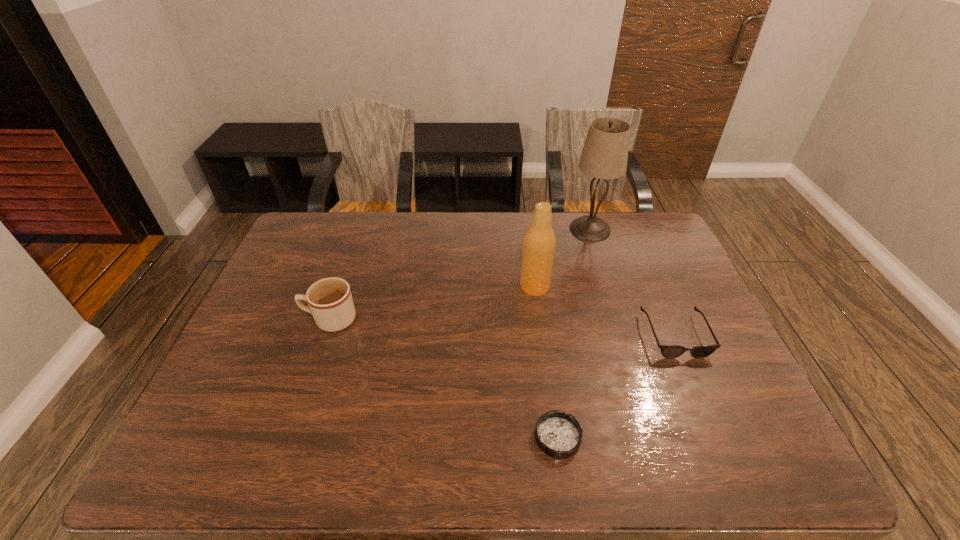
Find the location of `the farthest object`. the farthest object is located at coordinates (604, 156).

Locate an element on the screen. lampshade is located at coordinates (604, 156).

Where is `the second tallest object`? Image resolution: width=960 pixels, height=540 pixels. the second tallest object is located at coordinates (x=539, y=243).

Identify the location of the fourth nearest object. Image resolution: width=960 pixels, height=540 pixels. (539, 243).

The image size is (960, 540). Identify the location of mug. (330, 302).

Identify the location of the leftmost object. Image resolution: width=960 pixels, height=540 pixels. (330, 302).

Where is `sunglasses`? The width and height of the screenshot is (960, 540). sunglasses is located at coordinates (668, 351).

Where is `ashtray`? ashtray is located at coordinates (559, 435).

At what (x,y) coordinates should I click in order to perform the action: click on the shortest object. Please return your answer as a coordinate pair (x, y). Looking at the image, I should click on (559, 435).

Locate an element on the screen. This screenshot has height=540, width=960. free space located 0.300m on the front-facing side of the lampshade is located at coordinates (613, 306).